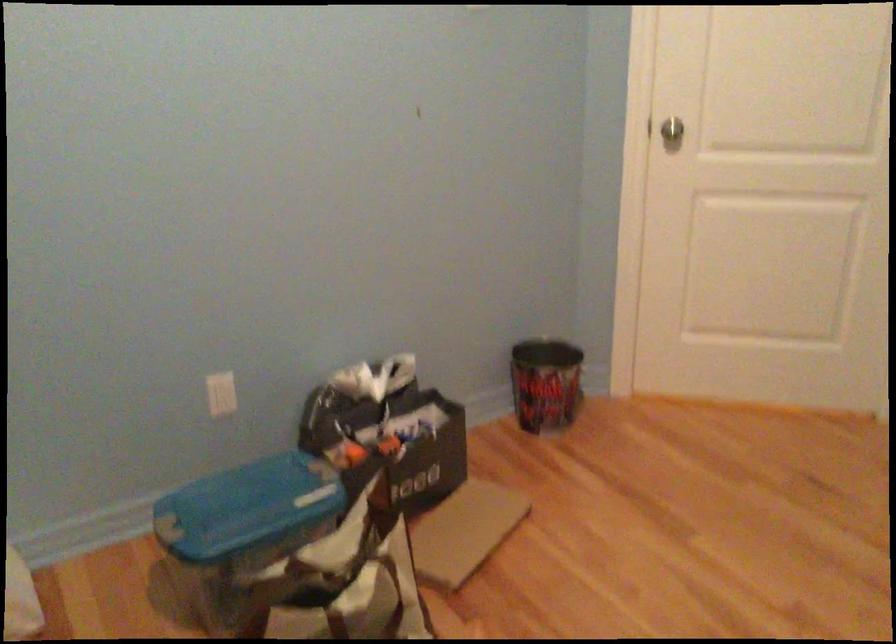
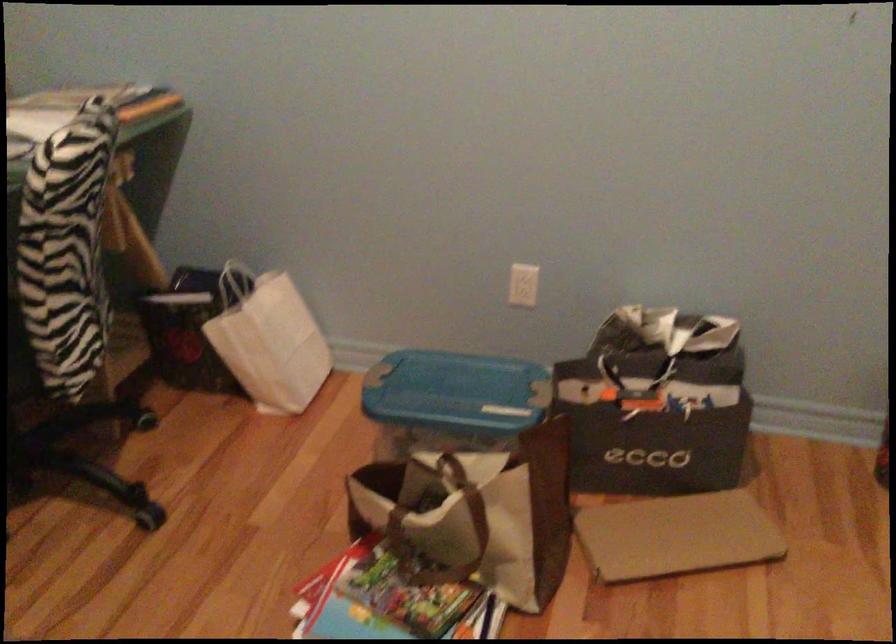
Question: How did the camera likely rotate?

Choices:
 (A) Left
 (B) Right
 (C) Up
 (D) Down

Answer: (A)